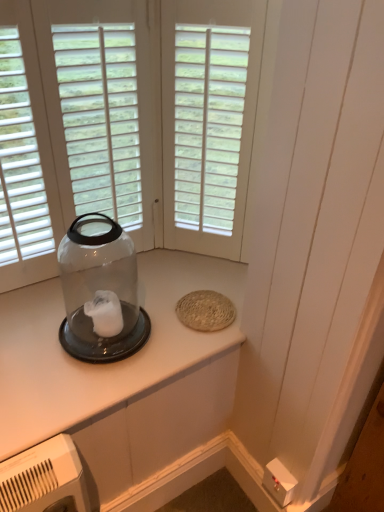
Question: From a real-world perspective, is clear plastic jar at upper left physically located above or below transparent glass jar at left?

Choices:
 (A) below
 (B) above

Answer: (A)

Question: Is clear plastic jar at upper left bigger or smaller than transparent glass jar at left?

Choices:
 (A) small
 (B) big

Answer: (A)

Question: Which object is the closest to the white matte window at center?

Choices:
 (A) transparent glass jar at left
 (B) clear plastic jar at upper left

Answer: (A)

Question: Estimate the real-world distances between objects in this image. Which object is farther from the clear plastic jar at upper left?

Choices:
 (A) transparent glass jar at left
 (B) white matte window at center

Answer: (B)